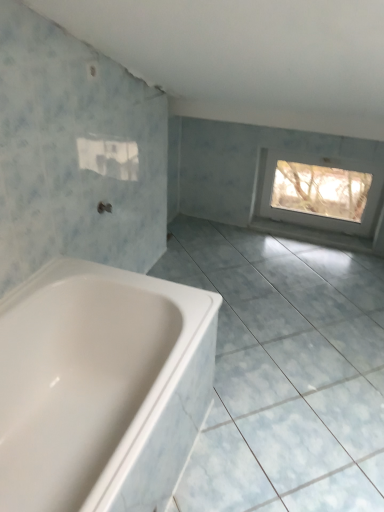
What are the coordinates of `transparent plastic window at upper right` in the screenshot? It's located at (318, 191).

Identify the location of matte silver tap at center. (104, 207).

Find the location of a particular element. The width and height of the screenshot is (384, 512). white glossy bathtub at lower left is located at coordinates (100, 386).

From a real-world perspective, which is physically below, transparent plastic window at upper right or white glossy ceramic tile at lower left?

white glossy ceramic tile at lower left is physically lower.

Is transparent plastic window at upper right next to white glossy ceramic tile at lower left and touching it?

There is a gap between transparent plastic window at upper right and white glossy ceramic tile at lower left.

Is transparent plastic window at upper right taller than white glossy ceramic tile at lower left?

Yes.

Who is bigger, matte silver tap at center or white glossy ceramic tile at lower left?

white glossy ceramic tile at lower left is bigger.

This screenshot has height=512, width=384. I want to click on ceramic tile in front of the matte silver tap at center, so click(x=285, y=373).

From the image's perspective, is matte silver tap at center located above or below white glossy ceramic tile at lower left?

Based on their image positions, matte silver tap at center is located above white glossy ceramic tile at lower left.

In the scene shown: Is matte silver tap at center to the right of white glossy ceramic tile at lower left from the viewer's perspective?

Incorrect, matte silver tap at center is not on the right side of white glossy ceramic tile at lower left.

Does transparent plastic window at upper right lie behind white glossy bathtub at lower left?

That is True.

From the image's perspective, which object appears higher, transparent plastic window at upper right or white glossy bathtub at lower left?

transparent plastic window at upper right is shown above in the image.

Is transparent plastic window at upper right wider or thinner than white glossy bathtub at lower left?

transparent plastic window at upper right is thinner than white glossy bathtub at lower left.

Does transparent plastic window at upper right contain white glossy bathtub at lower left?

Definitely not — white glossy bathtub at lower left is not inside transparent plastic window at upper right.

Is white glossy bathtub at lower left directly adjacent to matte silver tap at center?

white glossy bathtub at lower left and matte silver tap at center are not in contact.

At what (x,y) coordinates should I click in order to perform the action: click on tap above the white glossy bathtub at lower left (from the image's perspective). Please return your answer as a coordinate pair (x, y). This screenshot has width=384, height=512. Looking at the image, I should click on (104, 207).

Is white glossy bathtub at lower left at the left side of matte silver tap at center?

Incorrect, white glossy bathtub at lower left is not on the left side of matte silver tap at center.

Is white glossy ceramic tile at lower left facing away from transparent plastic window at upper right?

white glossy ceramic tile at lower left does not have its back to transparent plastic window at upper right.

Looking at this image, does white glossy ceramic tile at lower left contain transparent plastic window at upper right?

Definitely not — transparent plastic window at upper right is not inside white glossy ceramic tile at lower left.

Would you say white glossy ceramic tile at lower left is to the left or to the right of transparent plastic window at upper right in the picture?

In the image, white glossy ceramic tile at lower left appears on the left side of transparent plastic window at upper right.

Is matte silver tap at center spatially inside transparent plastic window at upper right, or outside of it?

matte silver tap at center is not inside transparent plastic window at upper right, it's outside.

Is transparent plastic window at upper right at the back of matte silver tap at center?

No.

Measure the distance from matte silver tap at center to transparent plastic window at upper right.

1.93 meters.

What's the angular difference between matte silver tap at center and transparent plastic window at upper right's facing directions?

The angular difference between matte silver tap at center and transparent plastic window at upper right is 83.6 degrees.

Can you see white glossy ceramic tile at lower left touching matte silver tap at center?

There is a gap between white glossy ceramic tile at lower left and matte silver tap at center.

Is white glossy ceramic tile at lower left looking in the opposite direction of matte silver tap at center?

No, matte silver tap at center is not at the back of white glossy ceramic tile at lower left.

Is white glossy ceramic tile at lower left inside or outside of matte silver tap at center?

white glossy ceramic tile at lower left is outside matte silver tap at center.

Where is `tap that appears above the white glossy ceramic tile at lower left (from a real-world perspective)`? Image resolution: width=384 pixels, height=512 pixels. tap that appears above the white glossy ceramic tile at lower left (from a real-world perspective) is located at coordinates (104, 207).

The height and width of the screenshot is (512, 384). What are the coordinates of `window that is behind the white glossy ceramic tile at lower left` in the screenshot? It's located at (318, 191).

Locate an element on the screen. Image resolution: width=384 pixels, height=512 pixels. ceramic tile that is under the matte silver tap at center (from a real-world perspective) is located at coordinates (x=285, y=373).

Which object lies further to the anchor point transparent plastic window at upper right, white glossy bathtub at lower left or white glossy ceramic tile at lower left?

Among the two, white glossy bathtub at lower left is located further to transparent plastic window at upper right.

Looking at the image, which one is located closer to transparent plastic window at upper right, white glossy ceramic tile at lower left or matte silver tap at center?

white glossy ceramic tile at lower left is closer to transparent plastic window at upper right.

When comparing their distances from white glossy bathtub at lower left, does white glossy ceramic tile at lower left or transparent plastic window at upper right seem closer?

white glossy ceramic tile at lower left is positioned closer to the anchor white glossy bathtub at lower left.

Estimate the real-world distances between objects in this image. Which object is further from white glossy ceramic tile at lower left, white glossy bathtub at lower left or transparent plastic window at upper right?

The object further to white glossy ceramic tile at lower left is transparent plastic window at upper right.

When comparing their distances from transparent plastic window at upper right, does matte silver tap at center or white glossy bathtub at lower left seem further?

Based on the image, white glossy bathtub at lower left appears to be further to transparent plastic window at upper right.

Which object lies further to the anchor point white glossy bathtub at lower left, matte silver tap at center or transparent plastic window at upper right?

transparent plastic window at upper right.

Which object lies nearer to the anchor point transparent plastic window at upper right, white glossy bathtub at lower left or matte silver tap at center?

matte silver tap at center is positioned closer to the anchor transparent plastic window at upper right.

Looking at the image, which one is located further to matte silver tap at center, white glossy bathtub at lower left or transparent plastic window at upper right?

transparent plastic window at upper right is positioned further to the anchor matte silver tap at center.

This screenshot has width=384, height=512. Identify the location of tap positioned between white glossy ceramic tile at lower left and transparent plastic window at upper right from near to far. (104, 207).

Image resolution: width=384 pixels, height=512 pixels. What are the coordinates of `tap positioned between white glossy bathtub at lower left and transparent plastic window at upper right from near to far` in the screenshot? It's located at (104, 207).

In order to click on ceramic tile between white glossy bathtub at lower left and transparent plastic window at upper right along the z-axis in this screenshot , I will do `click(285, 373)`.

Identify the location of ceramic tile between white glossy bathtub at lower left and matte silver tap at center in the front-back direction. This screenshot has height=512, width=384. tap(285, 373).